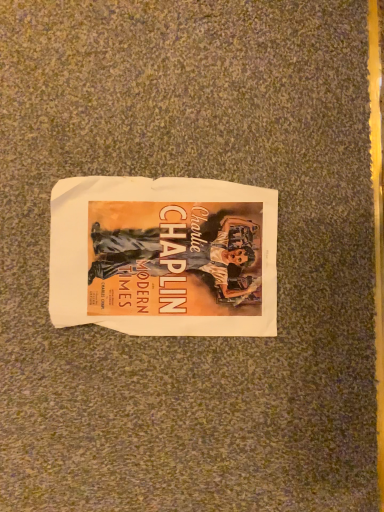
At what (x,y) coordinates should I click in order to perform the action: click on orange paper poster at center. Please return your answer as a coordinate pair (x, y). Looking at the image, I should click on (164, 256).

In the scene shown: Measure the distance between point (100, 322) and camera.

Point (100, 322) and camera are 21.65 inches apart.

What do you see at coordinates (164, 256) in the screenshot? I see `orange paper poster at center` at bounding box center [164, 256].

In order to face orange paper poster at center, should I rotate leftwards or rightwards?

Turn left by 2.563 degrees to look at orange paper poster at center.

Find the location of a particular element. orange paper poster at center is located at coordinates (164, 256).